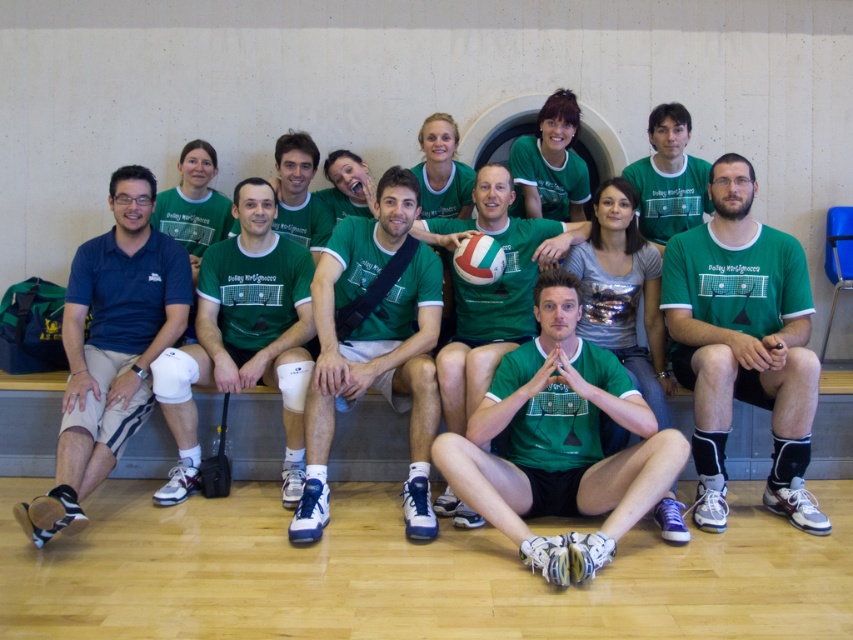
Can you confirm if matte blue polo shirt at left is positioned above green matte knee pads at center?

No.

What do you see at coordinates (109, 348) in the screenshot? I see `matte blue polo shirt at left` at bounding box center [109, 348].

Where is `matte blue polo shirt at left`? matte blue polo shirt at left is located at coordinates (109, 348).

Locate an element on the screen. Image resolution: width=853 pixels, height=640 pixels. green jersey at center is located at coordinates (374, 344).

Which is behind, point (440, 298) or point (675, 180)?

The point (675, 180) is behind.

In order to click on green jersey at center in this screenshot , I will do (x=374, y=344).

Does green jersey at center have a lesser height compared to green matte/vinyl volleyball at center?

No, green jersey at center is not shorter than green matte/vinyl volleyball at center.

Is point (344, 356) farther from viewer compared to point (529, 268)?

No, (344, 356) is in front of (529, 268).

Where is `green jersey at center`? Image resolution: width=853 pixels, height=640 pixels. green jersey at center is located at coordinates (374, 344).